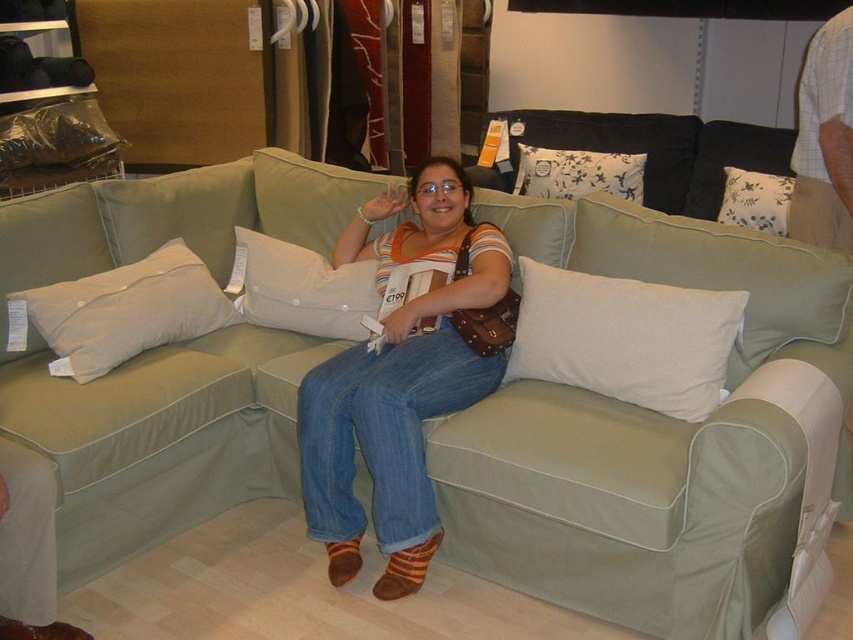
You are helping arrange pillows on a sofa in a furniture store. You have a beige fabric pillow at left and a white printed fabric pillow at center. According to the scene, which pillow is positioned further to the left?

The beige fabric pillow at left is positioned further to the left than the white printed fabric pillow at center.